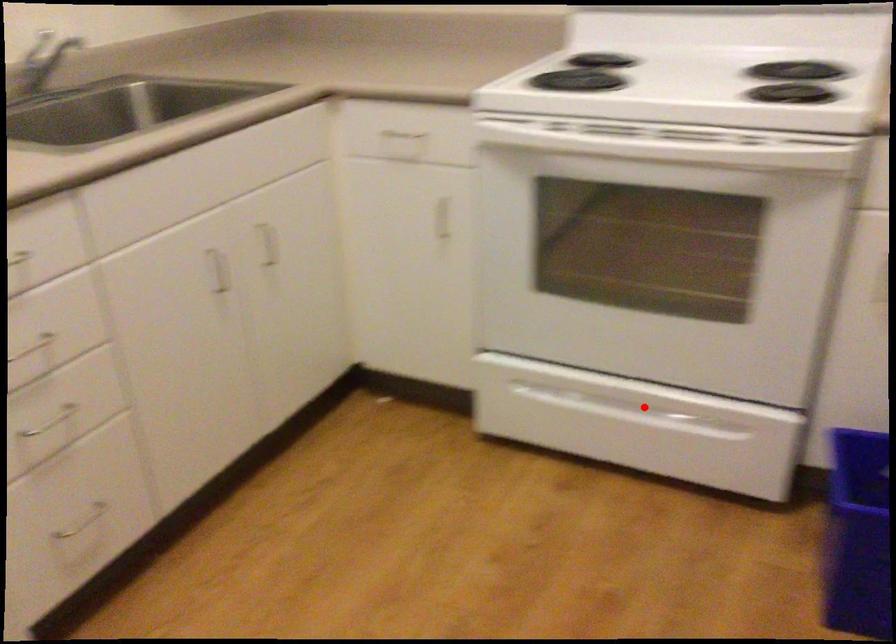
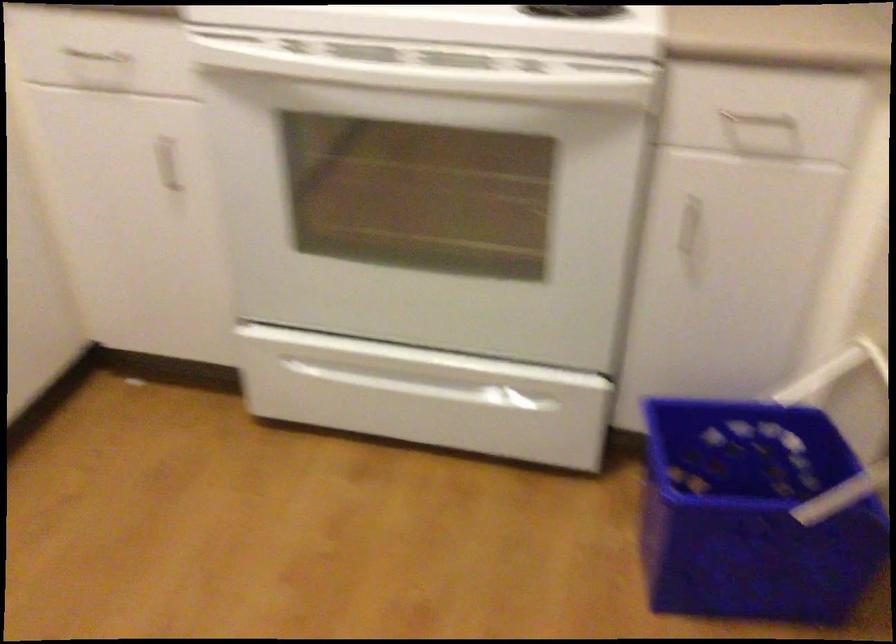
Find the pixel in the second image that matches the highlighted location in the first image.

(435, 379)